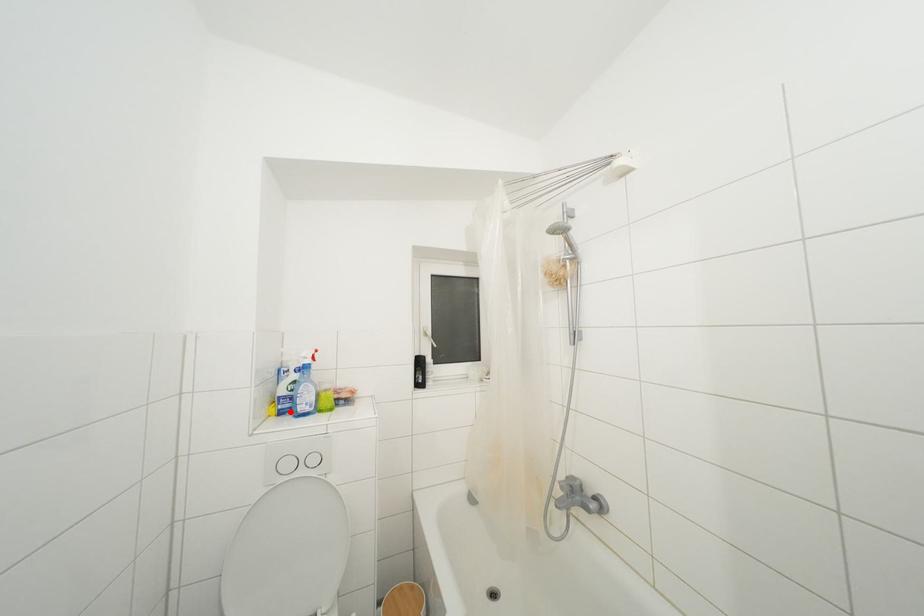
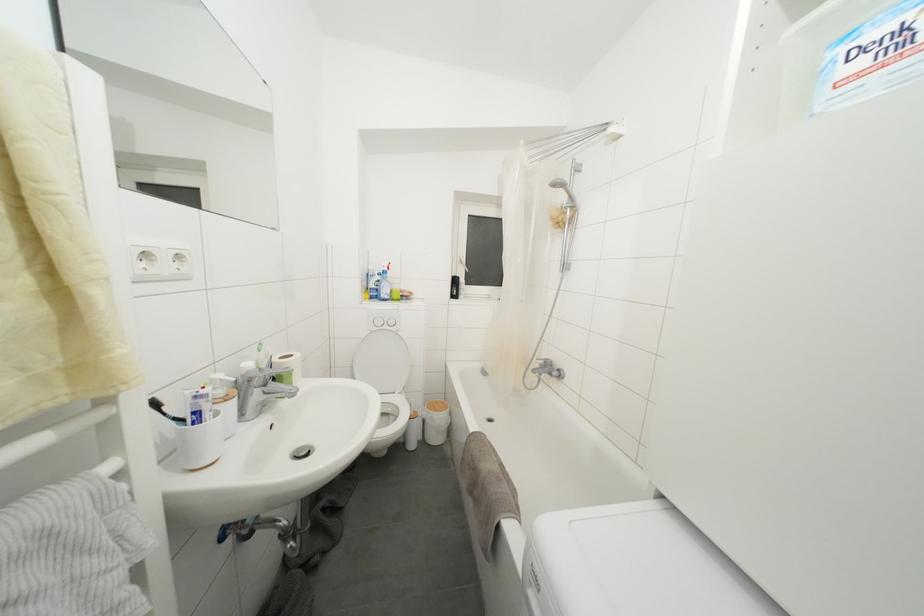
The point at the highlighted location is marked in the first image. Where is the corresponding point in the second image?

(379, 300)